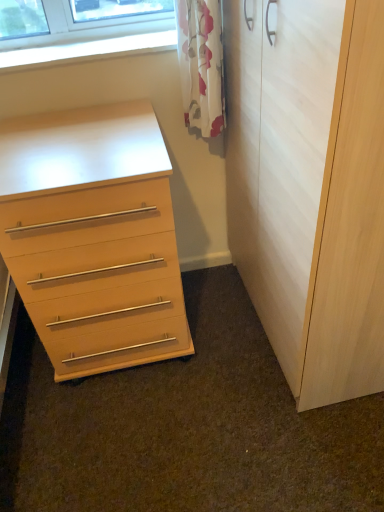
This screenshot has height=512, width=384. What are the coordinates of `vacant region to the left of light wood/texture cupboard at right` in the screenshot? It's located at [192, 362].